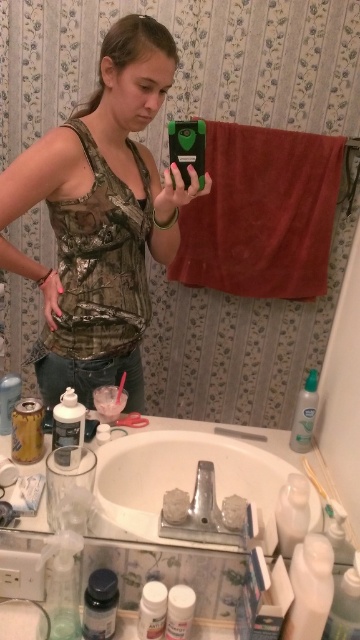
Question: Among these points, which one is nearest to the camera?

Choices:
 (A) (155, 628)
 (B) (298, 509)
 (C) (204, 182)
 (D) (290, 579)

Answer: (D)

Question: Among these objects, which one is farthest from the camera?

Choices:
 (A) camo fabric tank top at center
 (B) clear plastic spray bottle at right

Answer: (B)

Question: Considering the real-world distances, which object is farthest from the clear plastic spray bottle at right?

Choices:
 (A) translucent plastic bottle at lower left
 (B) white plastic bottle at lower left
 (C) white ceramic sink at center
 (D) white glossy lotion at lower right

Answer: (A)

Question: Is white ceramic sink at center smaller than translucent plastic bottle at lower left?

Choices:
 (A) yes
 (B) no

Answer: (B)

Question: Does camo fabric tank top at center come in front of clear plastic spray bottle at right?

Choices:
 (A) no
 (B) yes

Answer: (B)

Question: From the image, what is the correct spatial relationship of clear plastic spray bottle at right in relation to white matte jar at lower center?

Choices:
 (A) below
 (B) above

Answer: (B)